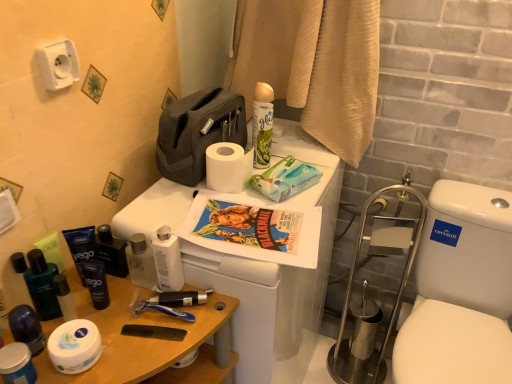
This screenshot has height=384, width=512. I want to click on vacant area that lies in front of white paper towels at center, so click(271, 228).